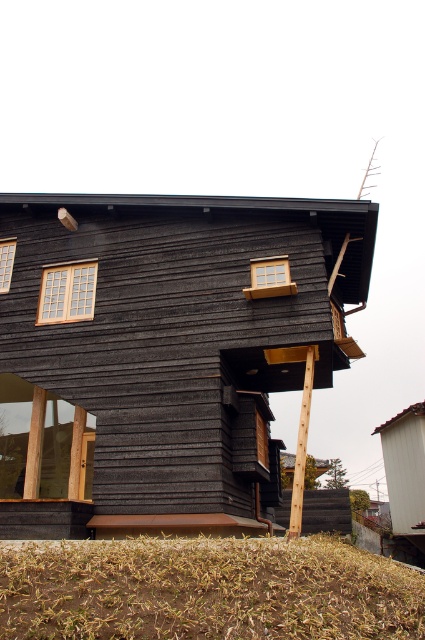
Question: Which of the following is the farthest from the observer?

Choices:
 (A) matte wood window at upper left
 (B) brown grass at lower center
 (C) transparent glass window at lower left
 (D) matte wooden window at upper left

Answer: (C)

Question: Estimate the real-world distances between objects in this image. Which object is farther from the transparent glass window at lower left?

Choices:
 (A) brown grass at lower center
 (B) matte wood window at upper left
 (C) matte wooden window at upper left
 (D) wooden window at center

Answer: (A)

Question: Which of the following is the farthest from the observer?

Choices:
 (A) brown grass at lower center
 (B) matte wooden window at upper left

Answer: (B)

Question: Observing the image, what is the correct spatial positioning of wooden window at center in reference to matte wooden window at upper left?

Choices:
 (A) right
 (B) left

Answer: (A)

Question: Is brown grass at lower center smaller than matte wooden window at upper left?

Choices:
 (A) no
 (B) yes

Answer: (A)

Question: In this image, where is brown grass at lower center located relative to matte wood window at upper left?

Choices:
 (A) right
 (B) left

Answer: (A)